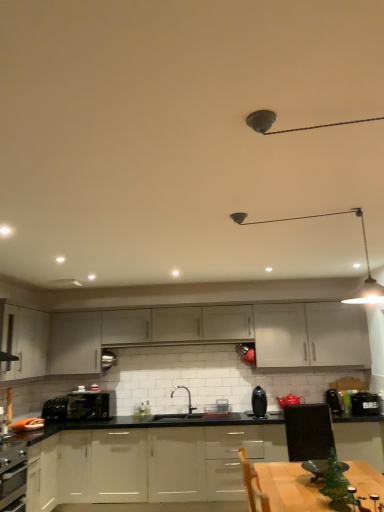
Question: Is white matte cabinet at center, arranged as the second cabinetry when viewed from the top, with black plastic toaster at lower left, which is counted as the second appliance, starting from the front?

Choices:
 (A) no
 (B) yes

Answer: (A)

Question: From the image's perspective, is white matte cabinet at center, the third cabinetry in the bottom-to-top sequence, over black plastic toaster at lower left, placed as the 1th appliance when sorted from left to right?

Choices:
 (A) no
 (B) yes

Answer: (B)

Question: Does white matte cabinet at center, arranged as the second cabinetry when viewed from the top, have a greater height compared to black plastic toaster at lower left, which ranks as the second appliance in right-to-left order?

Choices:
 (A) yes
 (B) no

Answer: (A)

Question: Considering the relative sizes of white matte cabinet at center, the third cabinetry in the bottom-to-top sequence, and black plastic toaster at lower left, which is counted as the second appliance, starting from the front, in the image provided, is white matte cabinet at center, the third cabinetry in the bottom-to-top sequence, wider than black plastic toaster at lower left, which is counted as the second appliance, starting from the front,?

Choices:
 (A) no
 (B) yes

Answer: (A)

Question: Is white matte cabinet at center, the third cabinetry in the bottom-to-top sequence, smaller than black plastic toaster at lower left, placed as the 1th appliance when sorted from left to right?

Choices:
 (A) yes
 (B) no

Answer: (B)

Question: Is white matte cabinet at center, arranged as the second cabinetry when viewed from the top, shorter than black plastic toaster at lower left, placed as the 1th appliance when sorted from left to right?

Choices:
 (A) yes
 (B) no

Answer: (B)

Question: Does satin black vase at center, the 2th kitchen appliance viewed from the left, have a smaller size compared to metallic silver toaster at center, which is the 2th kitchen appliance in front-to-back order?

Choices:
 (A) yes
 (B) no

Answer: (A)

Question: From the image's perspective, would you say satin black vase at center, the 2th kitchen appliance viewed from the left, is positioned over metallic silver toaster at center, which ranks as the first kitchen appliance in back-to-front order?

Choices:
 (A) no
 (B) yes

Answer: (B)

Question: Is satin black vase at center, the 1th kitchen appliance when ordered from right to left, facing away from metallic silver toaster at center, placed as the 1th kitchen appliance when sorted from left to right?

Choices:
 (A) yes
 (B) no

Answer: (B)

Question: Can you confirm if satin black vase at center, the 1th kitchen appliance when ordered from right to left, is bigger than metallic silver toaster at center, which is the 2th kitchen appliance in front-to-back order?

Choices:
 (A) yes
 (B) no

Answer: (B)

Question: Is satin black vase at center, the 2th kitchen appliance viewed from the left, outside metallic silver toaster at center, which is the 2th kitchen appliance in front-to-back order?

Choices:
 (A) no
 (B) yes

Answer: (B)

Question: Is satin black vase at center, the 2th kitchen appliance viewed from the back, next to metallic silver toaster at center, which is the 2th kitchen appliance in front-to-back order, and touching it?

Choices:
 (A) no
 (B) yes

Answer: (A)

Question: Is matte gray cabinet at center, which is the 2th cabinetry from bottom to top, a part of black plastic toaster at lower left, marked as the 1th appliance in a back-to-front arrangement?

Choices:
 (A) no
 (B) yes

Answer: (A)